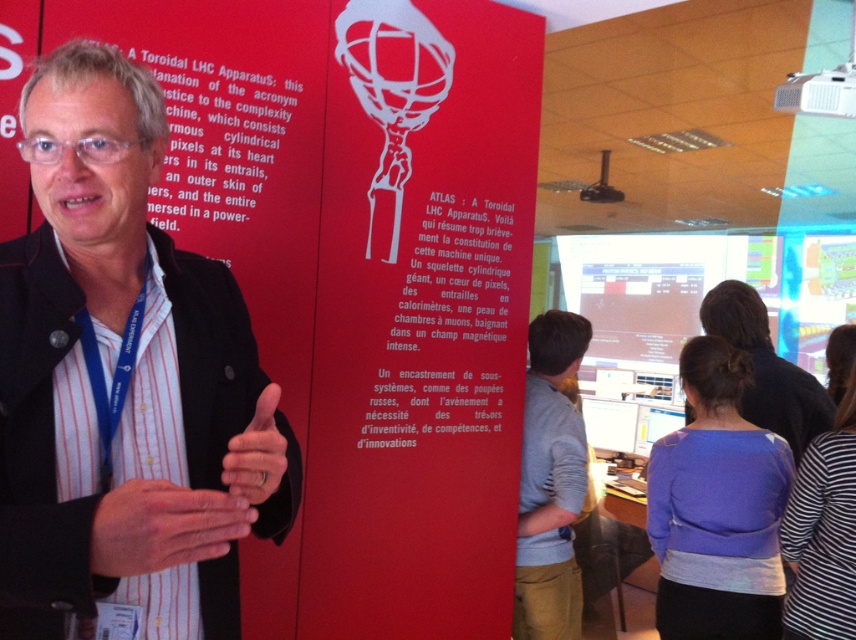
Who is more forward, (182, 298) or (744, 406)?

Point (182, 298)

Is black matte jacket at left behind matte black shirt at center?

No.

Describe the element at coordinates (117, 380) in the screenshot. Image resolution: width=856 pixels, height=640 pixels. I see `black matte jacket at left` at that location.

You are a GUI agent. You are given a task and a screenshot of the screen. Output one action in this format:
    pyautogui.click(x=<x>, y=<y>)
    Task: Click on the black matte jacket at left
    The height and width of the screenshot is (640, 856).
    Given the screenshot: What is the action you would take?
    pyautogui.click(x=117, y=380)

Does point (556, 563) come in front of point (740, 285)?

Yes, it is.

The image size is (856, 640). In order to click on gray cotton shirt at center in this screenshot , I will do `click(550, 483)`.

Image resolution: width=856 pixels, height=640 pixels. What are the coordinates of `gray cotton shirt at center` in the screenshot? It's located at 550,483.

Does gray cotton shirt at center have a smaller size compared to matte black hand at center?

Incorrect, gray cotton shirt at center is not smaller in size than matte black hand at center.

Who is shorter, gray cotton shirt at center or matte black hand at center?

matte black hand at center

Where is `gray cotton shirt at center`? The image size is (856, 640). gray cotton shirt at center is located at coordinates (550, 483).